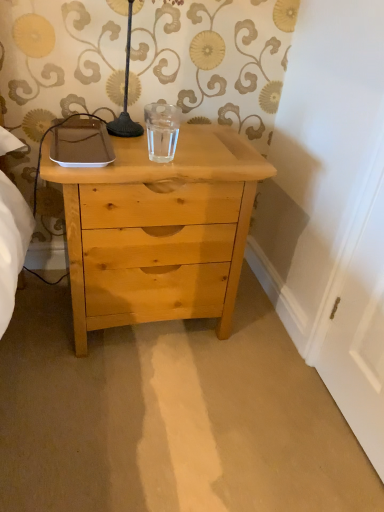
The height and width of the screenshot is (512, 384). I want to click on natural wood chest of drawers at center, so click(159, 230).

Measure the distance between natural wood chest of drawers at center and camera.

natural wood chest of drawers at center is 37.94 inches from camera.

The image size is (384, 512). Describe the element at coordinates (159, 230) in the screenshot. I see `natural wood chest of drawers at center` at that location.

Where is `natural wood chest of drawers at center`? The image size is (384, 512). natural wood chest of drawers at center is located at coordinates (159, 230).